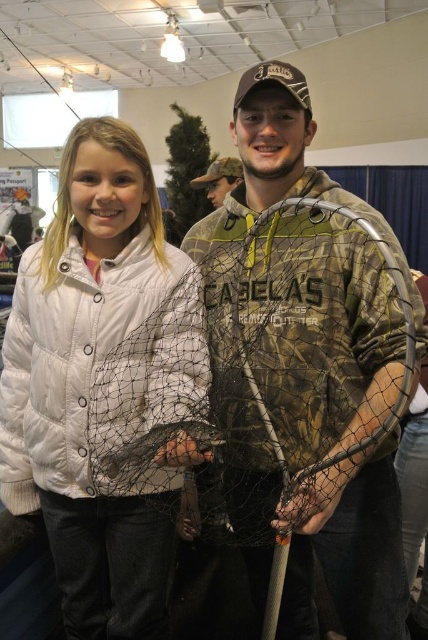
Between camo fabric fishing net at center and white puffy jacket at center, which one is positioned higher?

camo fabric fishing net at center

This screenshot has width=428, height=640. Identify the location of camo fabric fishing net at center. (306, 369).

Which is below, white puffy jacket at center or camouflage fabric hat at upper center?

white puffy jacket at center

Does white puffy jacket at center appear under camouflage fabric hat at upper center?

Indeed, white puffy jacket at center is positioned under camouflage fabric hat at upper center.

Between point (62, 429) and point (211, 177), which one is positioned in front?

Point (62, 429) is in front.

Find the location of a particular element. This screenshot has width=428, height=640. white puffy jacket at center is located at coordinates (89, 381).

Between white puffy jacket at center and translucent netting at center, which one has more height?

white puffy jacket at center

Is point (18, 305) in front of point (107, 444)?

No.

You are a GUI agent. You are given a task and a screenshot of the screen. Output one action in this format:
    pyautogui.click(x=<x>, y=<y>)
    Task: Click on the white puffy jacket at center
    The image size is (428, 640).
    Given the screenshot: What is the action you would take?
    pyautogui.click(x=89, y=381)